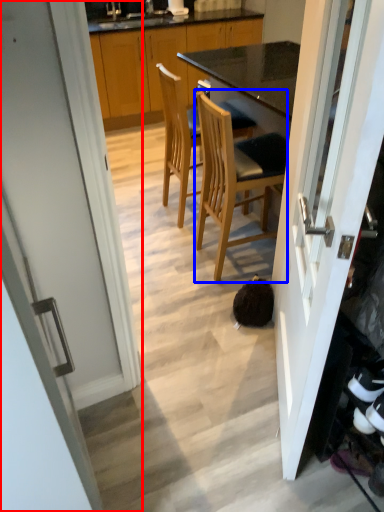
Question: Among these objects, which one is nearest to the camera, door (highlighted by a red box) or chair (highlighted by a blue box)?

Choices:
 (A) door
 (B) chair

Answer: (A)